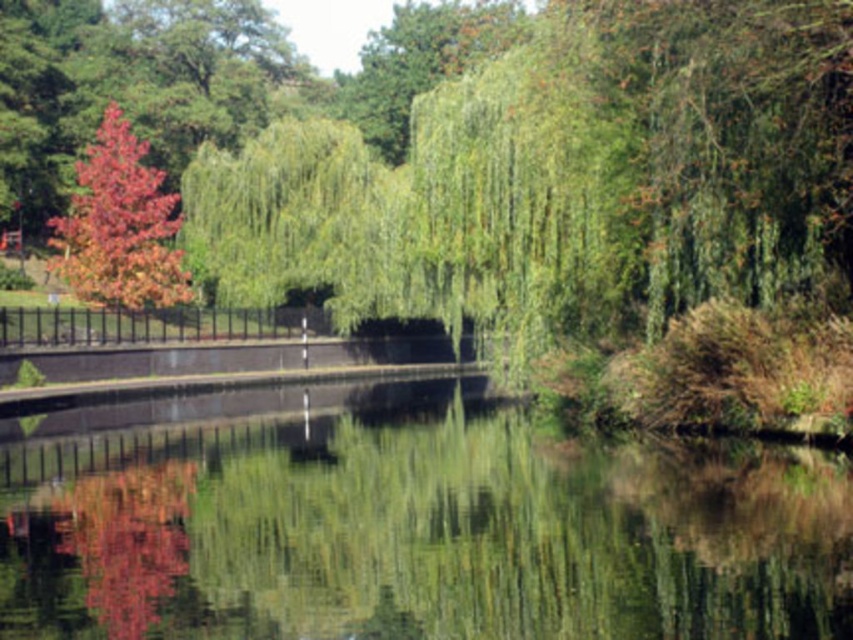
You are standing in the serene natural scene described. You want to locate the green reflective water at center. Where exactly should you look?

You should look at point [415,528] to find the green reflective water at center.

You are an artist trying to paint the scene. You want to place the shiny red leaves at left to the right of the green reflective water at center. Is this possible given their current positions?

The green reflective water at center is positioned on the right side of shiny red leaves at left, so the shiny red leaves at left are already to the left of the green reflective water at center. Therefore, moving them to the right would require changing their current position.

You are standing in front of the serene natural scene. You want to place a small boat on the water surface. Since the shiny red leaves at left are blocking your view of the green reflective water at center, can you still see the water surface clearly?

The green reflective water at center is closer to the viewer than the shiny red leaves at left, so you can still see the water surface clearly because the leaves are behind it and not blocking the view.